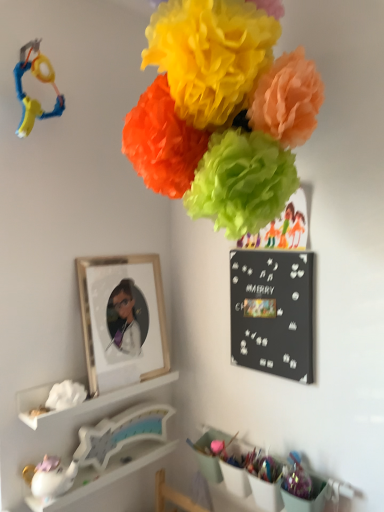
Question: From a real-world perspective, is white glossy unicorn at lower left, which is the first toy in bottom-to-top order, physically above blue plastic toy at upper left, which ranks as the 2th toy in bottom-to-top order?

Choices:
 (A) no
 (B) yes

Answer: (A)

Question: Is white glossy unicorn at lower left, which is the first toy in bottom-to-top order, turned away from blue plastic toy at upper left, the first toy when ordered from top to bottom?

Choices:
 (A) no
 (B) yes

Answer: (A)

Question: Is white glossy unicorn at lower left, which is the second toy in top-to-bottom order, to the right of blue plastic toy at upper left, which ranks as the 2th toy in bottom-to-top order, from the viewer's perspective?

Choices:
 (A) no
 (B) yes

Answer: (A)

Question: Is white glossy unicorn at lower left, which is the second toy in top-to-bottom order, facing towards blue plastic toy at upper left, which ranks as the 2th toy in bottom-to-top order?

Choices:
 (A) yes
 (B) no

Answer: (B)

Question: From a real-world perspective, is white glossy unicorn at lower left, which is the first toy in bottom-to-top order, located beneath blue plastic toy at upper left, which ranks as the 2th toy in bottom-to-top order?

Choices:
 (A) yes
 (B) no

Answer: (A)

Question: From the image's perspective, would you say white glossy unicorn at lower left, which is the second toy in top-to-bottom order, is positioned over blue plastic toy at upper left, the first toy when ordered from top to bottom?

Choices:
 (A) no
 (B) yes

Answer: (A)

Question: Can you confirm if white glossy unicorn at lower left, which is the second toy in top-to-bottom order, is positioned to the left of matte tissue paper flowers at upper center, which is the 1th flower from front to back?

Choices:
 (A) yes
 (B) no

Answer: (A)

Question: Is white glossy unicorn at lower left, which is the first toy in bottom-to-top order, shorter than matte tissue paper flowers at upper center, marked as the 2th flower in a back-to-front arrangement?

Choices:
 (A) yes
 (B) no

Answer: (A)

Question: Can you see white glossy unicorn at lower left, which is the second toy in top-to-bottom order, touching matte tissue paper flowers at upper center, placed as the first flower when sorted from top to bottom?

Choices:
 (A) no
 (B) yes

Answer: (A)

Question: Can you confirm if white glossy unicorn at lower left, which is the first toy in bottom-to-top order, is wider than matte tissue paper flowers at upper center, placed as the first flower when sorted from top to bottom?

Choices:
 (A) no
 (B) yes

Answer: (A)

Question: Is white glossy unicorn at lower left, which is the first toy in bottom-to-top order, facing towards matte tissue paper flowers at upper center, the 1th flower from the right?

Choices:
 (A) yes
 (B) no

Answer: (B)

Question: Does white glossy unicorn at lower left, which is the second toy in top-to-bottom order, have a smaller size compared to matte tissue paper flowers at upper center, which is the 1th flower from front to back?

Choices:
 (A) yes
 (B) no

Answer: (A)

Question: Does white fluffy tissue at lower left, the first flower from the bottom, have a greater width compared to blue plastic toy at upper left, which ranks as the 2th toy in bottom-to-top order?

Choices:
 (A) no
 (B) yes

Answer: (A)